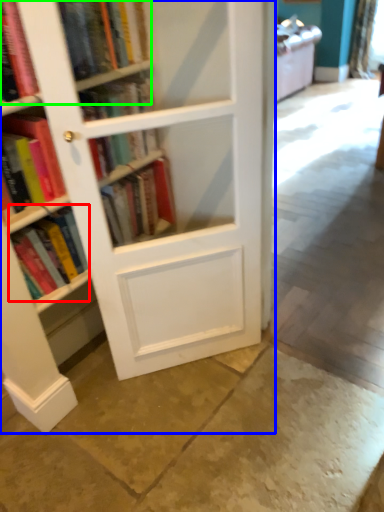
Question: Which is nearer to the book (highlighted by a red box)? bookcase (highlighted by a blue box) or book (highlighted by a green box).

Choices:
 (A) bookcase
 (B) book

Answer: (A)